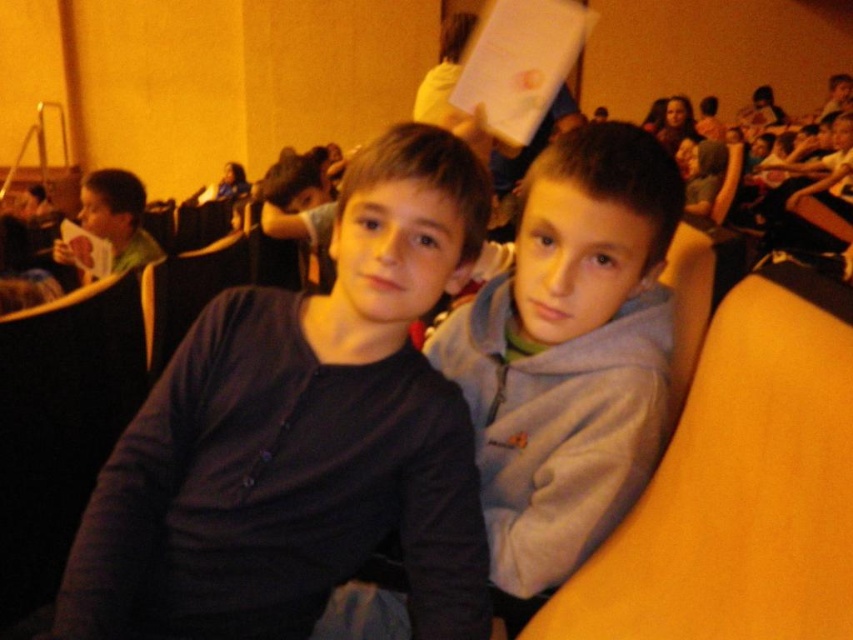
Can you confirm if dark blue shirt at center is positioned to the left of matte green sweater at left?

Incorrect, dark blue shirt at center is not on the left side of matte green sweater at left.

What do you see at coordinates (302, 436) in the screenshot? I see `dark blue shirt at center` at bounding box center [302, 436].

Identify the location of dark blue shirt at center. click(x=302, y=436).

Who is lower down, dark blue shirt at center or matte black hair at upper center?

dark blue shirt at center is below.

Locate an element on the screen. dark blue shirt at center is located at coordinates (302, 436).

Find the location of `dark blue shirt at center`. dark blue shirt at center is located at coordinates (302, 436).

Does point (451, 177) lie in front of point (248, 184)?

Yes, point (451, 177) is in front of point (248, 184).

What do you see at coordinates (302, 436) in the screenshot? This screenshot has width=853, height=640. I see `dark blue shirt at center` at bounding box center [302, 436].

I want to click on dark blue shirt at center, so click(x=302, y=436).